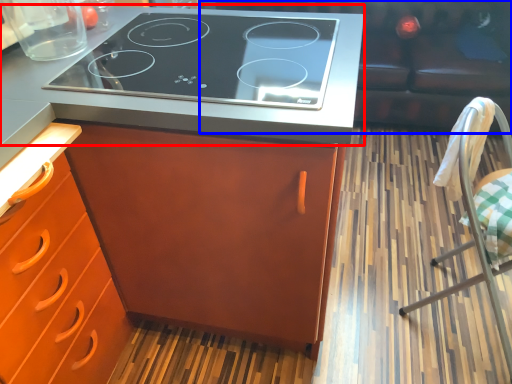
Question: Which point is further to the camera, countertop (highlighted by a red box) or couch (highlighted by a blue box)?

Choices:
 (A) countertop
 (B) couch

Answer: (B)